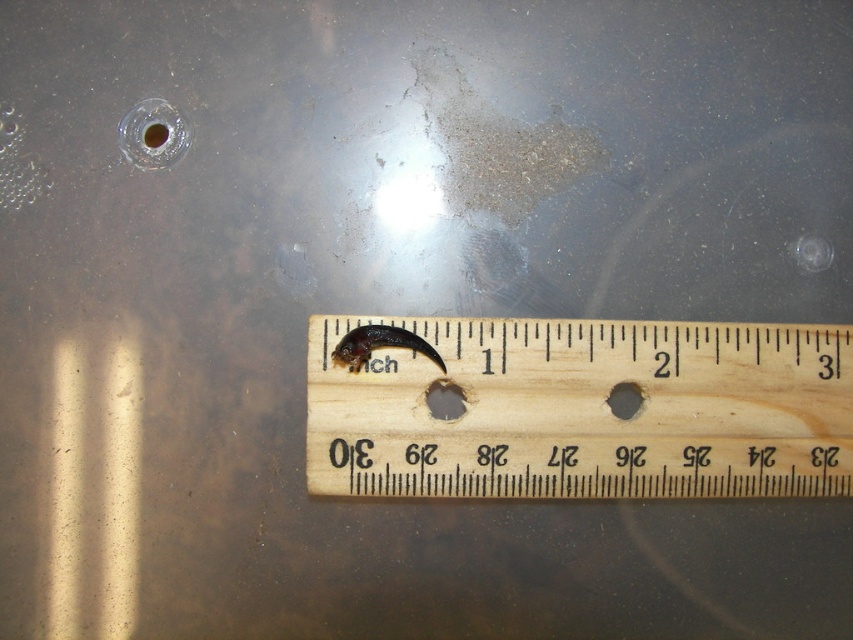
Is wooden ruler at center thinner than matte plastic hole at center?

No, wooden ruler at center is not thinner than matte plastic hole at center.

Which is below, wooden ruler at center or matte plastic hole at center?

Positioned lower is wooden ruler at center.

Does point (389, 323) come farther from viewer compared to point (450, 410)?

No, it is not.

Where is `wooden ruler at center`? This screenshot has height=640, width=853. wooden ruler at center is located at coordinates (581, 410).

How far apart are wooden ruler at center and matte black hole at center?

A distance of 6.69 inches exists between wooden ruler at center and matte black hole at center.

Between wooden ruler at center and matte black hole at center, which one appears on the left side from the viewer's perspective?

From the viewer's perspective, wooden ruler at center appears more on the left side.

What are the coordinates of `wooden ruler at center` in the screenshot? It's located at [581, 410].

Can you confirm if matte plastic hole at center is positioned to the right of matte black hole at center?

In fact, matte plastic hole at center is to the left of matte black hole at center.

What do you see at coordinates (444, 400) in the screenshot? I see `matte plastic hole at center` at bounding box center [444, 400].

What are the coordinates of `matte plastic hole at center` in the screenshot? It's located at (444, 400).